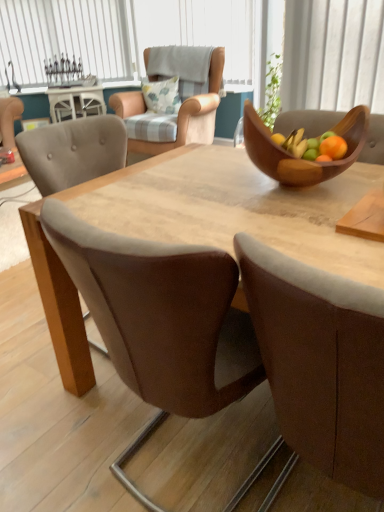
Question: In terms of width, does light brown wooden table at center look wider or thinner when compared to fluffy white pillow at upper center?

Choices:
 (A) wide
 (B) thin

Answer: (A)

Question: Is light brown wooden table at center taller or shorter than fluffy white pillow at upper center?

Choices:
 (A) tall
 (B) short

Answer: (A)

Question: Which object is the closest to the wooden bowl at center?

Choices:
 (A) white vertical blinds at upper left
 (B) fluffy white pillow at upper center
 (C) white glossy cabinet at upper left
 (D) brown leather chair at center, which is the 2th chair from top to bottom
 (E) light brown wooden table at center

Answer: (E)

Question: Which of these objects is positioned closest to the light brown wooden table at center?

Choices:
 (A) white glossy cabinet at upper left
 (B) wooden bowl at center
 (C) light brown fabric armchair at upper center, positioned as the 2th chair in front-to-back order
 (D) brown leather chair at center, the second chair positioned from the back
 (E) fluffy white pillow at upper center

Answer: (B)